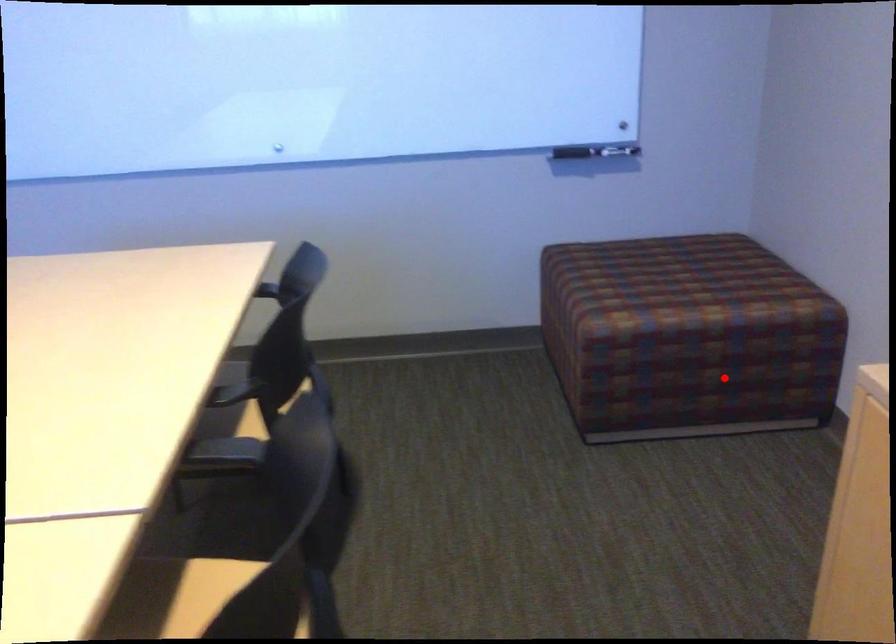
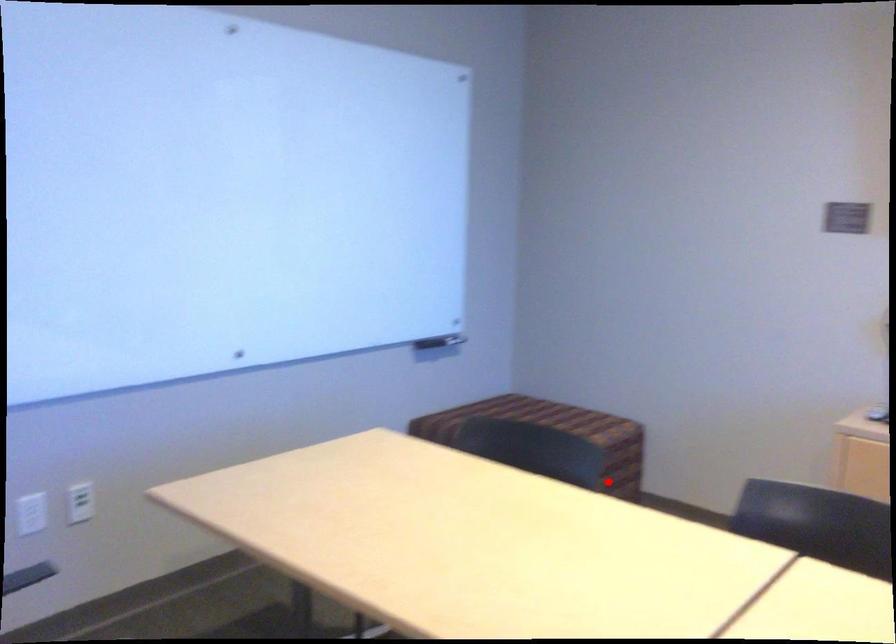
I am providing you with two images of the same scene from different viewpoints. A red point is marked on the first image and another point is marked on the second image. Is the red point in image1 aligned with the point shown in image2?

Yes